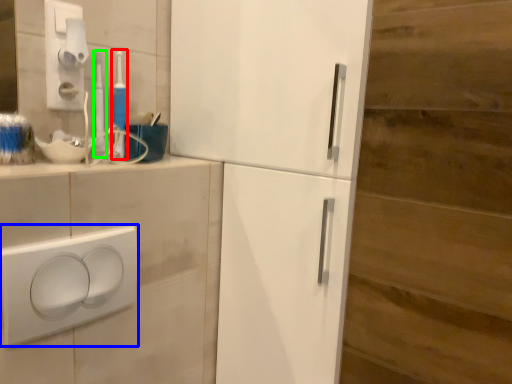
Question: Considering the real-world distances, which object is farthest from toothbrush (highlighted by a red box)? light switch (highlighted by a blue box) or toothbrush (highlighted by a green box)?

Choices:
 (A) light switch
 (B) toothbrush

Answer: (A)